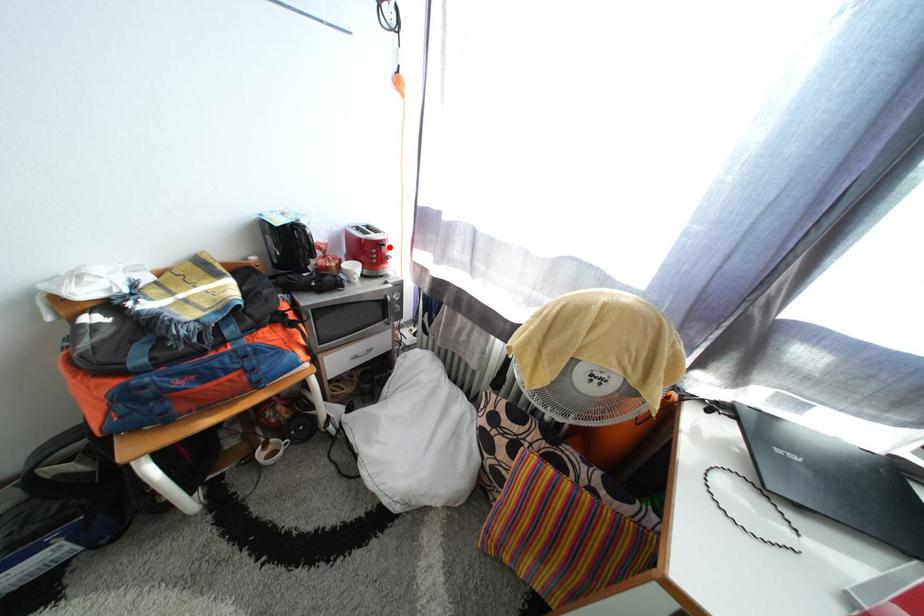
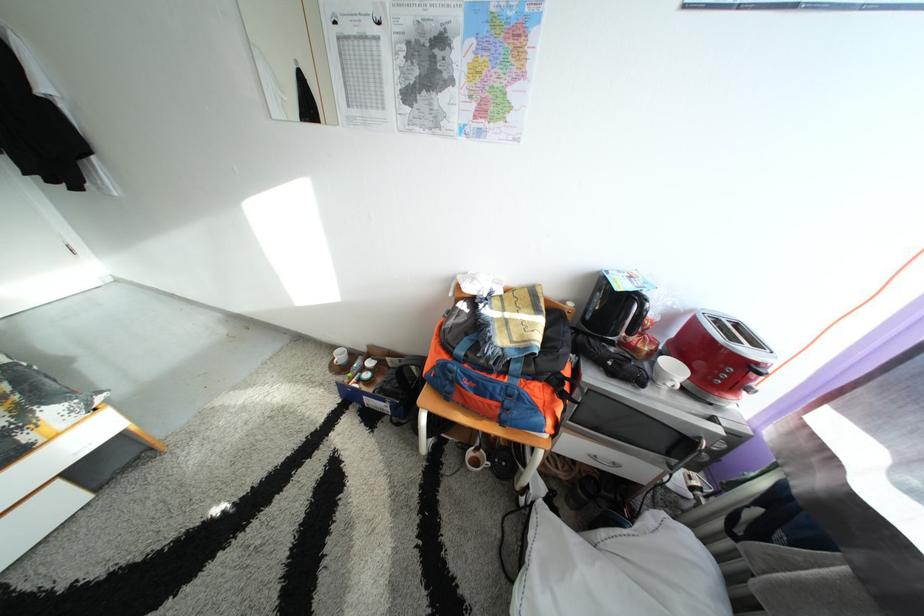
Find the pixel in the second image that matches the highlighted location in the first image.

(767, 370)